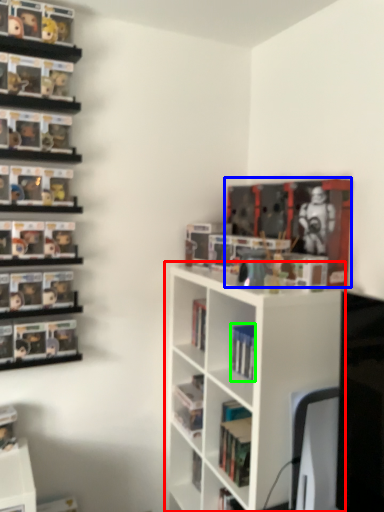
Question: Considering the real-world distances, which object is closest to shelf (highlighted by a red box)? book (highlighted by a blue box) or book (highlighted by a green box).

Choices:
 (A) book
 (B) book

Answer: (B)